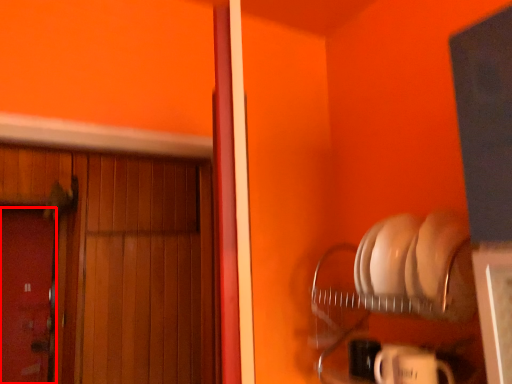
Question: From the image's perspective, considering the relative positions of door (annotated by the red box) and door in the image provided, where is door (annotated by the red box) located with respect to the staircase?

Choices:
 (A) below
 (B) above

Answer: (A)